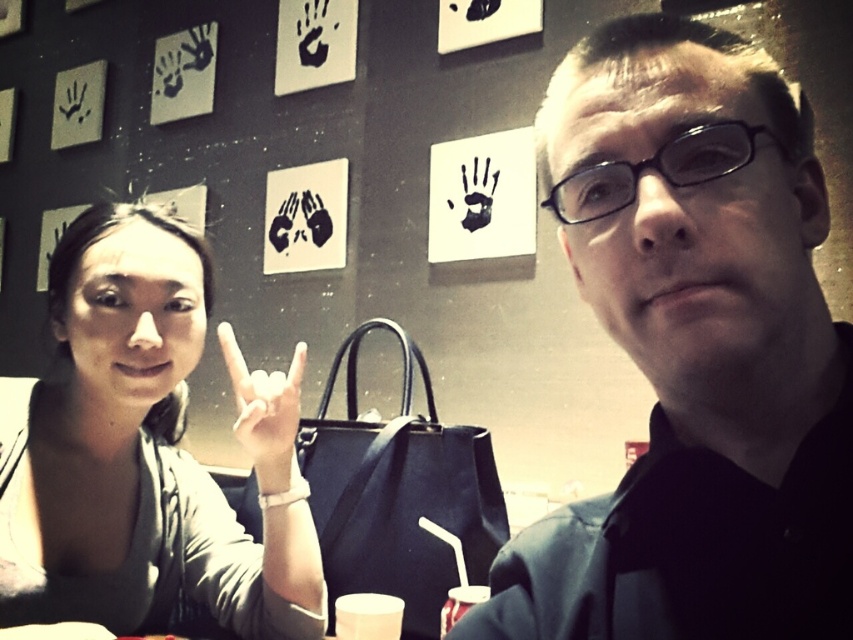
Is matte gray shirt at left taller than white matte cup at lower center?

Correct, matte gray shirt at left is much taller as white matte cup at lower center.

Is point (167, 548) positioned after point (376, 632)?

That is True.

At what (x,y) coordinates should I click in order to perform the action: click on matte gray shirt at left. Please return your answer as a coordinate pair (x, y). Looking at the image, I should click on (149, 451).

Which of these two, black matte shirt at center or translucent plastic cup at lower center, stands taller?

black matte shirt at center

Is point (786, 625) positioned after point (465, 593)?

No, it is not.

This screenshot has width=853, height=640. Find the location of `black matte shirt at center`. black matte shirt at center is located at coordinates (694, 352).

Measure the distance between white matte hand at center and camera.

A distance of 33.98 inches exists between white matte hand at center and camera.

Can you confirm if white matte hand at center is shorter than white matte cup at lower center?

No, white matte hand at center is not shorter than white matte cup at lower center.

The height and width of the screenshot is (640, 853). In order to click on white matte hand at center in this screenshot , I will do `click(264, 406)`.